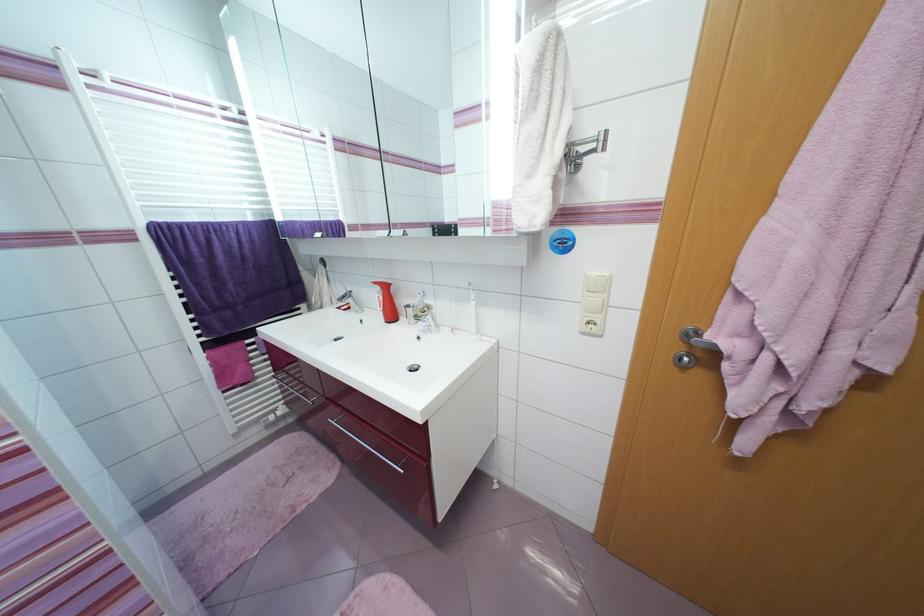
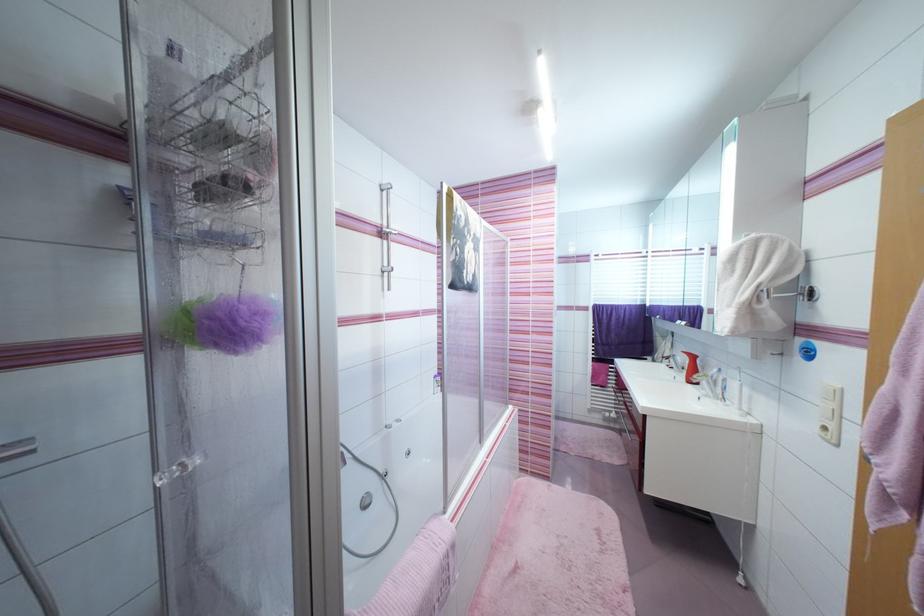
Find the pixel in the second image that matches [535,177] in the first image.

(735, 307)